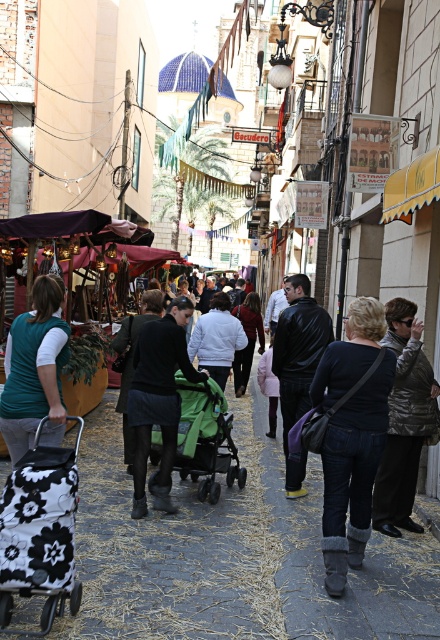
Question: Does dark blue denim jeans at center have a larger size compared to black matte skirt at center?

Choices:
 (A) no
 (B) yes

Answer: (A)

Question: Which object is closer to the camera taking this photo?

Choices:
 (A) white matte jacket at center
 (B) dark blue denim jeans at center
 (C) teal jersey at center
 (D) black matte skirt at center

Answer: (B)

Question: Which point is closer to the camera?

Choices:
 (A) dark blue denim jeans at center
 (B) shiny silver jacket at right
 (C) black matte skirt at center
 (D) leather jacket at center

Answer: (A)

Question: Is shiny silver jacket at right positioned at the back of white matte jacket at center?

Choices:
 (A) yes
 (B) no

Answer: (B)

Question: Can you confirm if leather jacket at center is smaller than white matte jacket at center?

Choices:
 (A) no
 (B) yes

Answer: (A)

Question: Which of the following is the closest to the observer?

Choices:
 (A) (212, 385)
 (B) (289, 356)

Answer: (A)